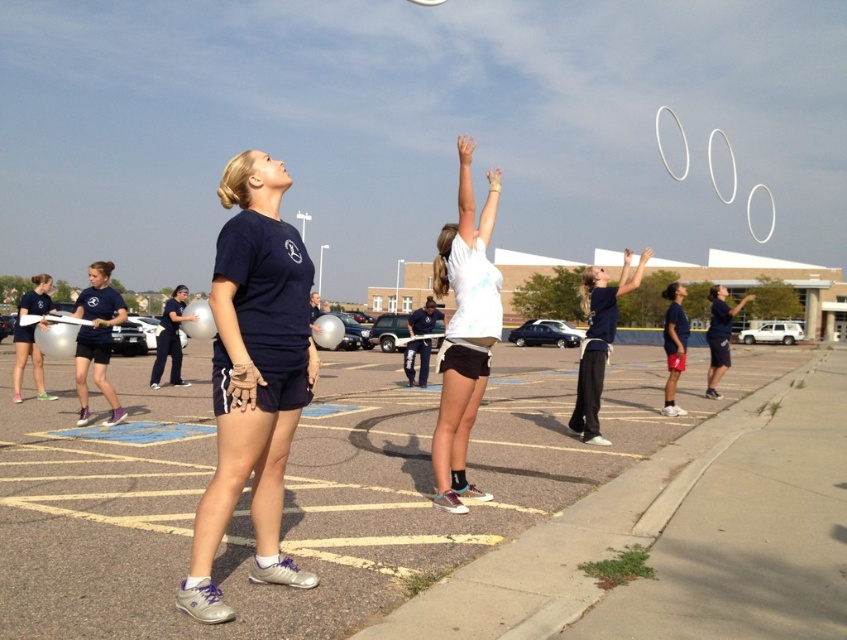
Which is behind, point (259, 384) or point (486, 497)?

Positioned behind is point (486, 497).

Does navy blue t-shirt at center appear on the left side of white matte shorts at center?

Indeed, navy blue t-shirt at center is positioned on the left side of white matte shorts at center.

Does point (285, 355) come closer to viewer compared to point (497, 170)?

That is True.

Where is `navy blue t-shirt at center`? Image resolution: width=847 pixels, height=640 pixels. navy blue t-shirt at center is located at coordinates (253, 378).